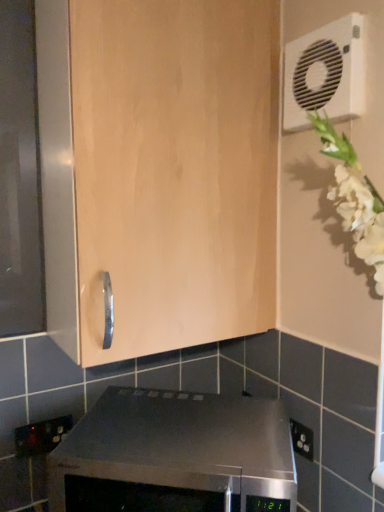
Question: Considering the positions of satin black oven at lower center and light wood cabinet at center in the image, is satin black oven at lower center taller or shorter than light wood cabinet at center?

Choices:
 (A) short
 (B) tall

Answer: (A)

Question: From the image's perspective, is satin black oven at lower center located above or below light wood cabinet at center?

Choices:
 (A) above
 (B) below

Answer: (B)

Question: Which object is positioned closest to the light wood cabinet at center?

Choices:
 (A) black plastic electric outlet at lower left
 (B) white plastic air conditioning unit at upper right
 (C) satin black oven at lower center

Answer: (B)

Question: Which is farther from the light wood cabinet at center?

Choices:
 (A) white plastic air conditioning unit at upper right
 (B) black plastic electric outlet at lower left
 (C) satin black oven at lower center

Answer: (B)